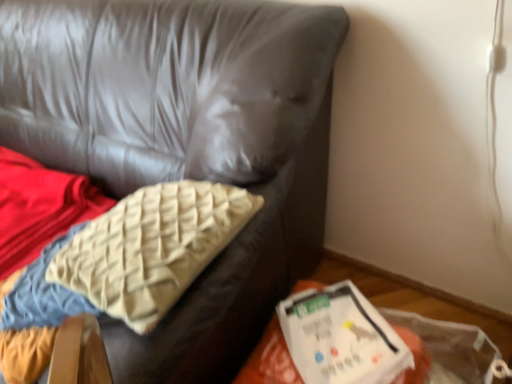
What is the approximate width of satin-like pillow at upper left?

The width of satin-like pillow at upper left is 38.06 inches.

The height and width of the screenshot is (384, 512). Identify the location of satin-like pillow at upper left. (185, 143).

What do you see at coordinates (185, 143) in the screenshot? I see `satin-like pillow at upper left` at bounding box center [185, 143].

The width and height of the screenshot is (512, 384). In order to click on satin-like pillow at upper left in this screenshot , I will do `click(185, 143)`.